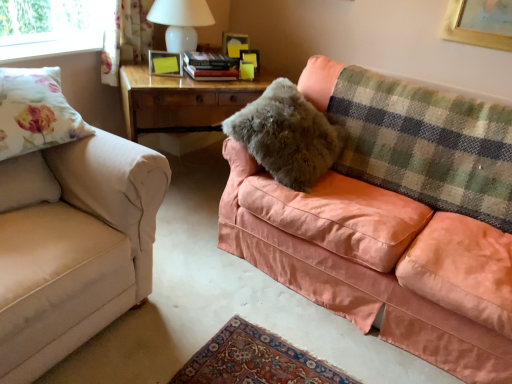
This screenshot has height=384, width=512. Find the location of `vacant area that is in front of matte yellow picture frame at center, placed as the first picture frame when sorted from left to right`. vacant area that is in front of matte yellow picture frame at center, placed as the first picture frame when sorted from left to right is located at coordinates (160, 81).